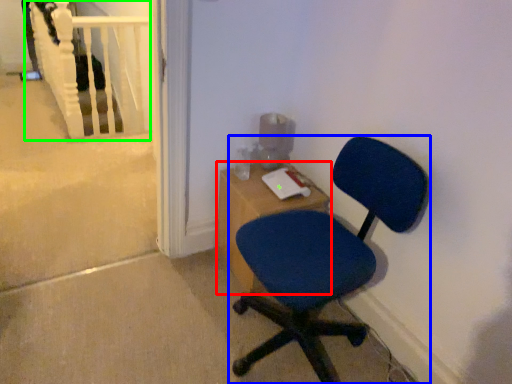
Question: Which object is the closest to the desk (highlighted by a red box)? Choose among these: chair (highlighted by a blue box) or rail (highlighted by a green box).

Choices:
 (A) chair
 (B) rail

Answer: (A)